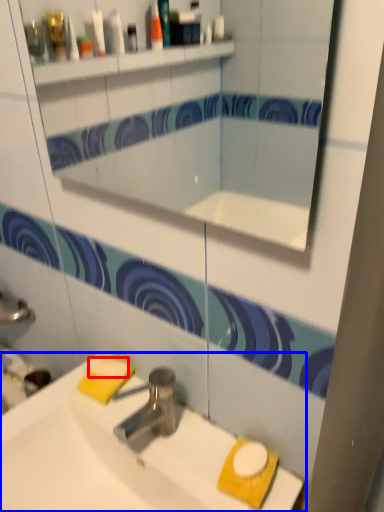
Question: Which point is closer to the camera, soap (highlighted by a red box) or sink (highlighted by a blue box)?

Choices:
 (A) soap
 (B) sink

Answer: (B)